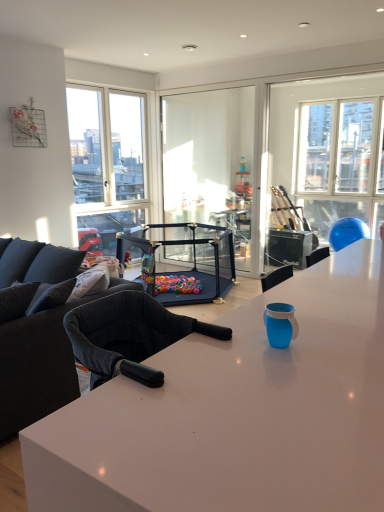
Question: From the image's perspective, is white glossy desk at center below black plastic playpen at center?

Choices:
 (A) no
 (B) yes

Answer: (B)

Question: Is white glossy desk at center closer to camera compared to black plastic playpen at center?

Choices:
 (A) yes
 (B) no

Answer: (A)

Question: Considering the relative sizes of white glossy desk at center and black plastic playpen at center in the image provided, is white glossy desk at center taller than black plastic playpen at center?

Choices:
 (A) yes
 (B) no

Answer: (A)

Question: Could you tell me if white glossy desk at center is facing black plastic playpen at center?

Choices:
 (A) no
 (B) yes

Answer: (A)

Question: Is white glossy desk at center shorter than black plastic playpen at center?

Choices:
 (A) no
 (B) yes

Answer: (A)

Question: Visually, is white glossy desk at center positioned to the left or to the right of black plastic playpen at center?

Choices:
 (A) right
 (B) left

Answer: (A)

Question: Is white glossy desk at center spatially inside black plastic playpen at center, or outside of it?

Choices:
 (A) inside
 (B) outside

Answer: (B)

Question: Considering their positions, is white glossy desk at center located in front of or behind black plastic playpen at center?

Choices:
 (A) behind
 (B) front

Answer: (B)

Question: In terms of width, does white glossy desk at center look wider or thinner when compared to black plastic playpen at center?

Choices:
 (A) wide
 (B) thin

Answer: (B)

Question: Relative to white glossy desk at center, is black fabric couch at left in front or behind?

Choices:
 (A) front
 (B) behind

Answer: (B)

Question: From the image's perspective, is black fabric couch at left above or below white glossy desk at center?

Choices:
 (A) above
 (B) below

Answer: (A)

Question: Considering the positions of black fabric couch at left and white glossy desk at center in the image, is black fabric couch at left taller or shorter than white glossy desk at center?

Choices:
 (A) tall
 (B) short

Answer: (B)

Question: Would you say black fabric couch at left is to the left or to the right of white glossy desk at center in the picture?

Choices:
 (A) right
 (B) left

Answer: (B)

Question: Is black plastic playpen at center wider or thinner than white glossy desk at center?

Choices:
 (A) wide
 (B) thin

Answer: (A)

Question: Does point (178, 237) appear closer or farther from the camera than point (294, 488)?

Choices:
 (A) closer
 (B) farther

Answer: (B)